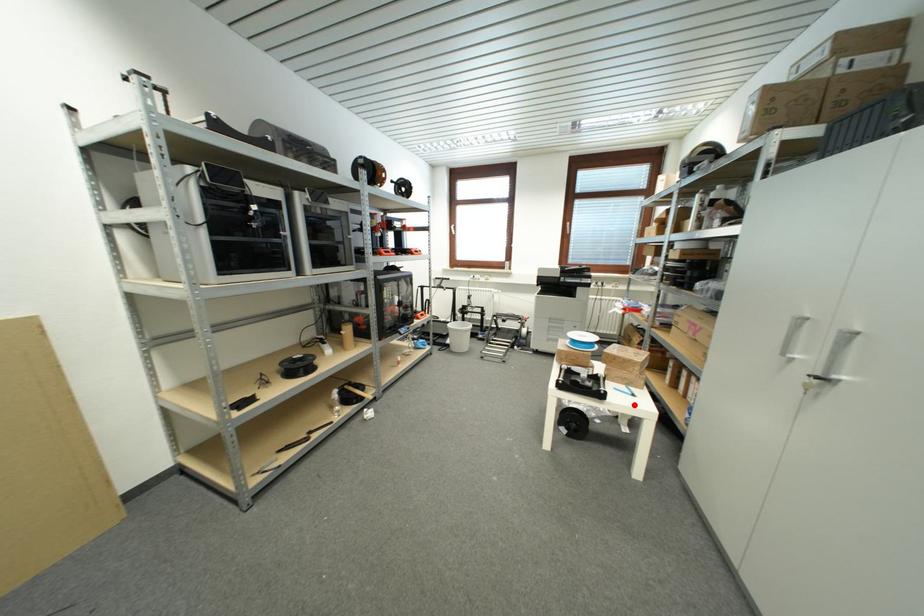
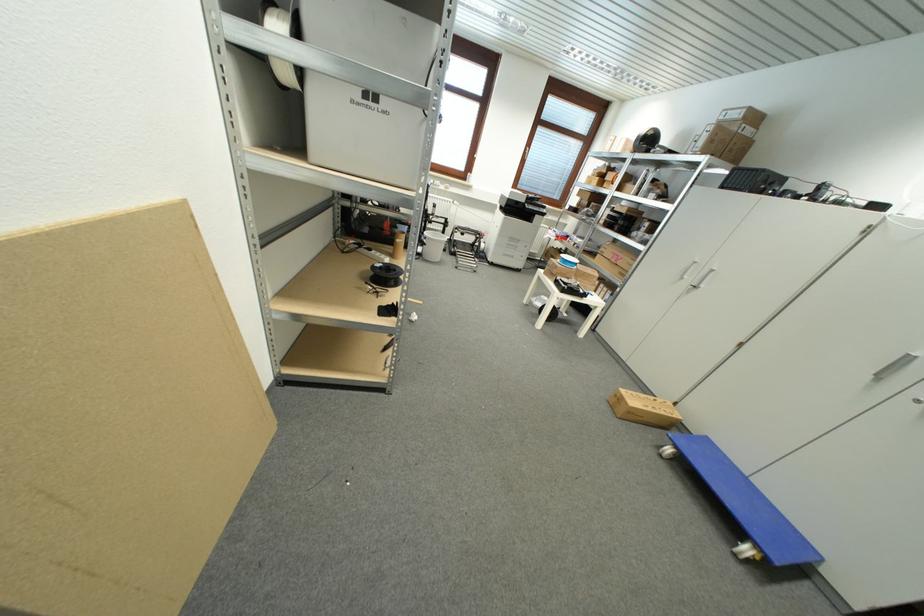
Question: I am providing you with two images of the same scene from different viewpoints. In image1, a red point is highlighted. Considering the same 3D point in image2, which of the following is correct?

Choices:
 (A) It is closer
 (B) It is farther

Answer: (A)